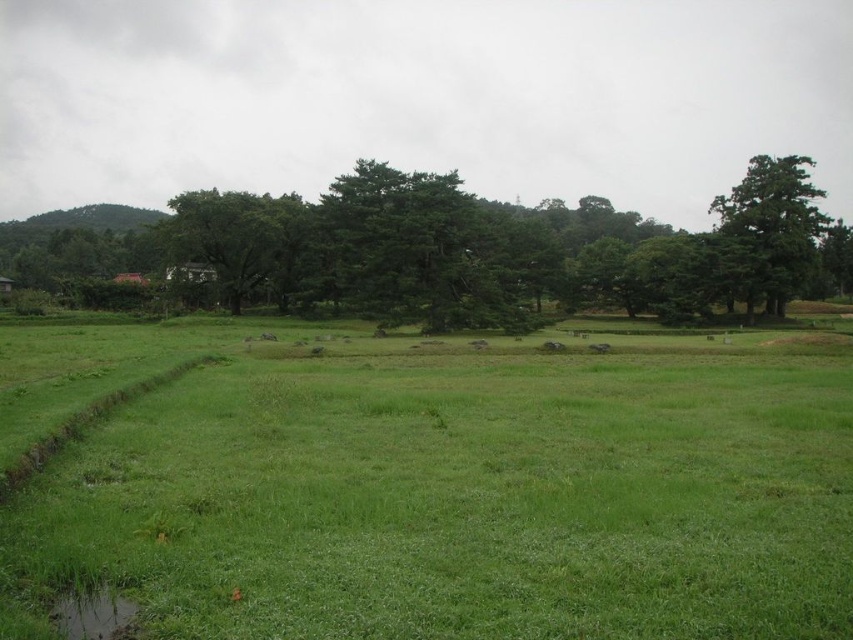
Who is taller, green leafy tree at left or green leafy tree at upper right?

Standing taller between the two is green leafy tree at upper right.

Does green leafy tree at left appear under green leafy tree at upper right?

Yes, green leafy tree at left is below green leafy tree at upper right.

Is point (218, 218) positioned after point (764, 240)?

No, it is in front of (764, 240).

Locate an element on the screen. Image resolution: width=853 pixels, height=640 pixels. green leafy tree at left is located at coordinates (241, 240).

Is green leafy tree at center smaller than green grassy puddle at lower left?

No.

Between green leafy tree at center and green grassy puddle at lower left, which one appears on the right side from the viewer's perspective?

From the viewer's perspective, green grassy puddle at lower left appears more on the right side.

What are the coordinates of `green leafy tree at center` in the screenshot? It's located at (454, 250).

Does green grassy field at center have a lesser height compared to green leafy tree at left?

Correct, green grassy field at center is not as tall as green leafy tree at left.

Consider the image. Can you confirm if green grassy field at center is positioned below green leafy tree at left?

Correct, green grassy field at center is located below green leafy tree at left.

The height and width of the screenshot is (640, 853). Find the location of `green grassy field at center`. green grassy field at center is located at coordinates (430, 484).

I want to click on green grassy field at center, so click(x=430, y=484).